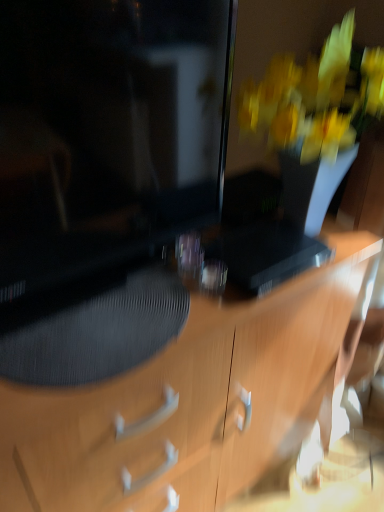
This screenshot has width=384, height=512. What are the coordinates of `vacant space underneath black textured drawer at center (from a real-world perspective)` in the screenshot? It's located at (105, 324).